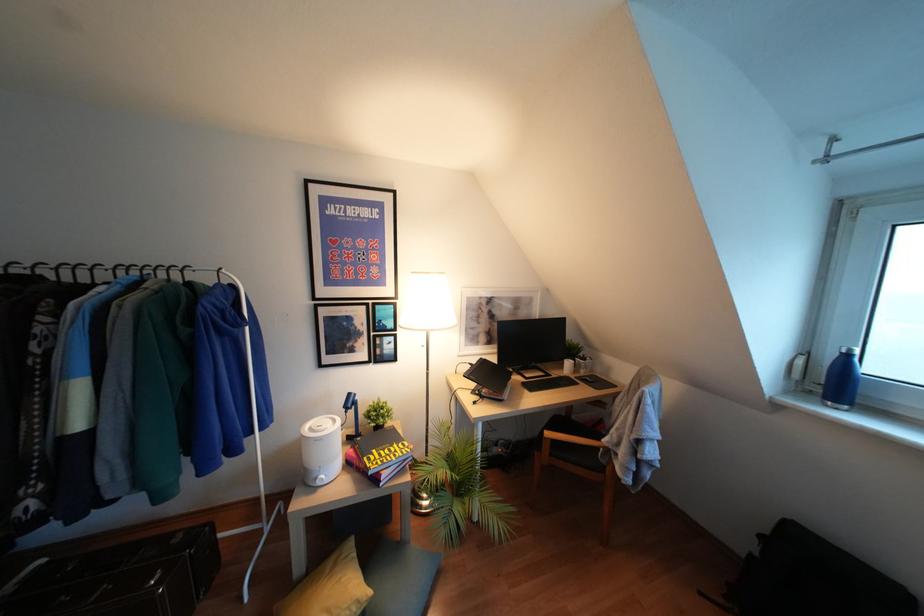
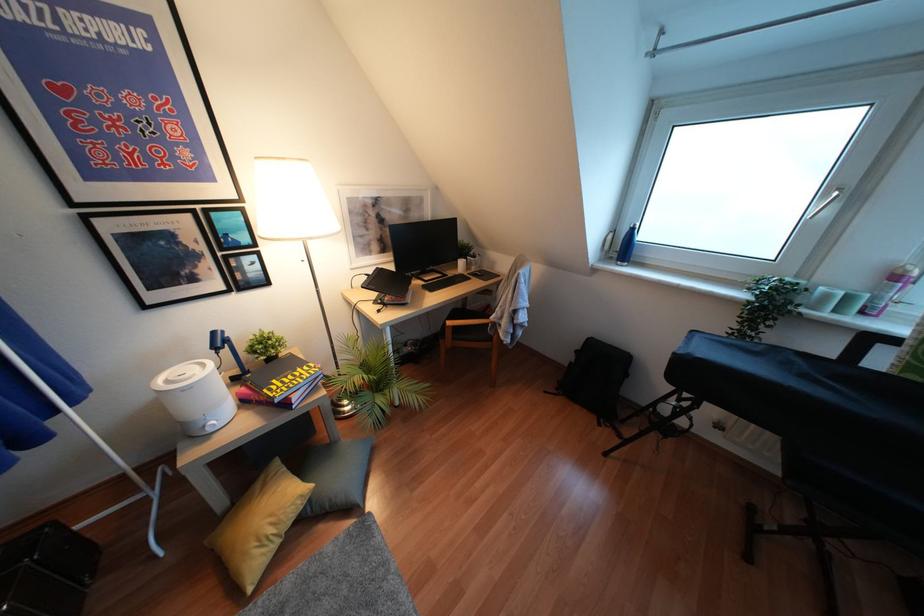
Locate, in the second image, the point that corresponds to the point at 760,537 in the first image.

(575, 351)